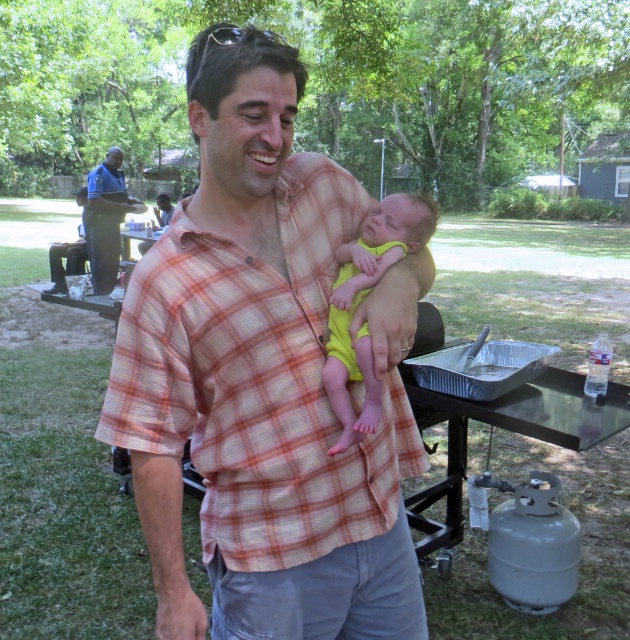
You are planning to take a photo of the plaid shirt at center and the yellow fabric baby at center. Since you want to ensure both are in focus, you need to know which object is wider. Which one is wider?

The plaid shirt at center is wider than the yellow fabric baby at center according to the description.

You are a photographer trying to capture the man in the plaid shirt at center holding the baby. You want to focus on the point at coordinates point (263, 378). Is this point on the man or the baby?

The point (263, 378) is on the plaid shirt at center, so it is on the man.

You are a photographer at the gathering and want to take a photo of both the plaid shirt at center and the yellow fabric baby at center. Which object should you focus on first to ensure both are in the frame?

The plaid shirt at center is in front of the yellow fabric baby at center, so you should focus on the plaid shirt at center first to ensure both are in the frame.